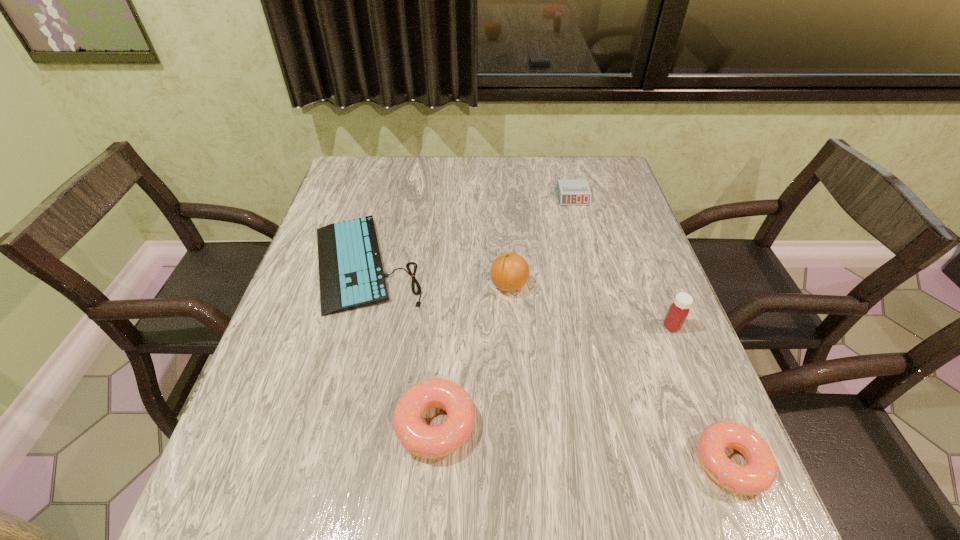
What are the coordinates of `vacant space that satisfies the following two spatial constraints: 1. on the back side of the shortest object; 2. on the right side of the farthest object` in the screenshot? It's located at (383, 197).